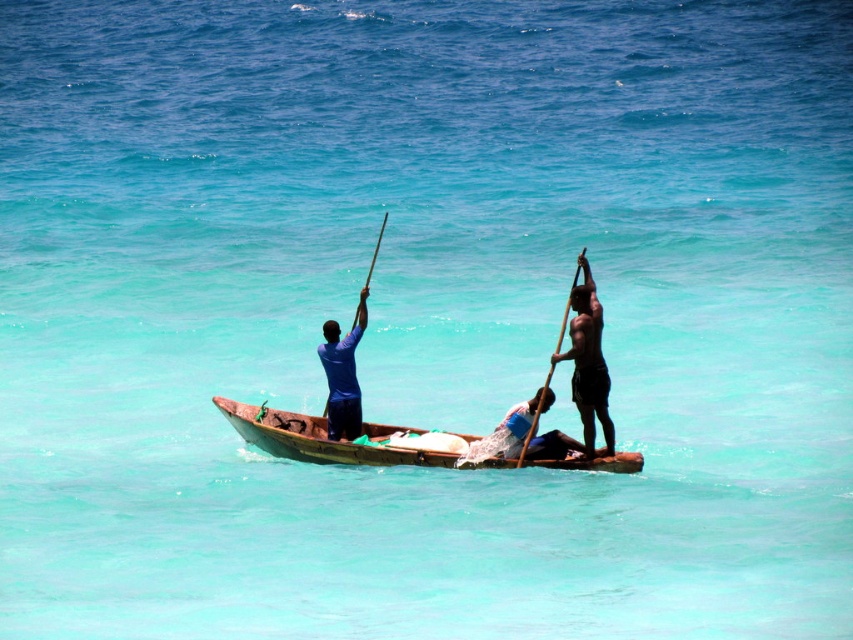
Question: Which point is closer to the camera?

Choices:
 (A) wooden pole at right
 (B) shiny black pole at right

Answer: (A)

Question: Which is nearer to the wooden canoe at center?

Choices:
 (A) blue fabric shirt at center
 (B) wooden pole at center

Answer: (A)

Question: Does blue fabric shirt at center come behind wooden pole at center?

Choices:
 (A) yes
 (B) no

Answer: (B)

Question: Observing the image, what is the correct spatial positioning of shiny black pole at right in reference to wooden pole at center?

Choices:
 (A) below
 (B) above

Answer: (A)

Question: Which point is closer to the camera taking this photo?

Choices:
 (A) (x=374, y=253)
 (B) (x=364, y=433)
 (C) (x=589, y=388)
 (D) (x=531, y=432)

Answer: (D)

Question: From the image, what is the correct spatial relationship of wooden canoe at center in relation to wooden pole at center?

Choices:
 (A) left
 (B) right

Answer: (B)